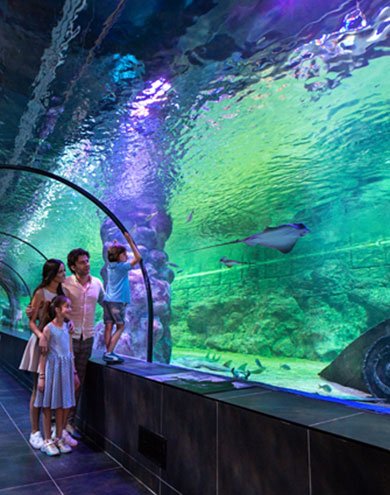
Locate an element on the screen. The height and width of the screenshot is (495, 390). aquarium is located at coordinates (300, 302).